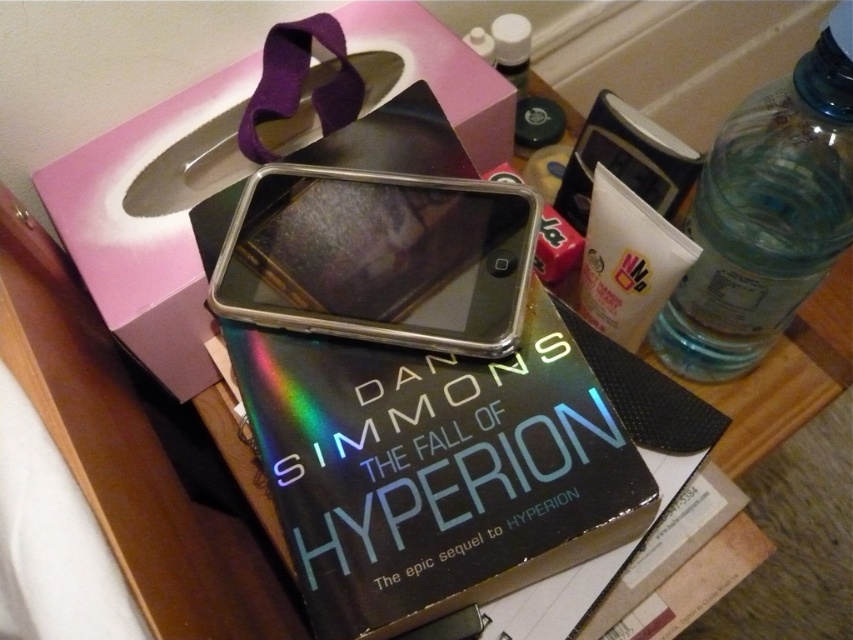
Question: Which object appears closest to the camera in this image?

Choices:
 (A) clear plastic bottle at right
 (B) clear plastic phone at center

Answer: (A)

Question: Which point is closer to the camera taking this photo?

Choices:
 (A) (294, 166)
 (B) (647, 508)

Answer: (B)

Question: Is holographic hardcover book at center to the right of clear plastic phone at center from the viewer's perspective?

Choices:
 (A) no
 (B) yes

Answer: (B)

Question: Which of these objects is positioned farthest from the clear plastic phone at center?

Choices:
 (A) holographic hardcover book at center
 (B) clear plastic bottle at right

Answer: (B)

Question: Where is holographic hardcover book at center located in relation to clear plastic phone at center in the image?

Choices:
 (A) left
 (B) right

Answer: (B)

Question: Is holographic hardcover book at center to the left of clear plastic bottle at right from the viewer's perspective?

Choices:
 (A) yes
 (B) no

Answer: (A)